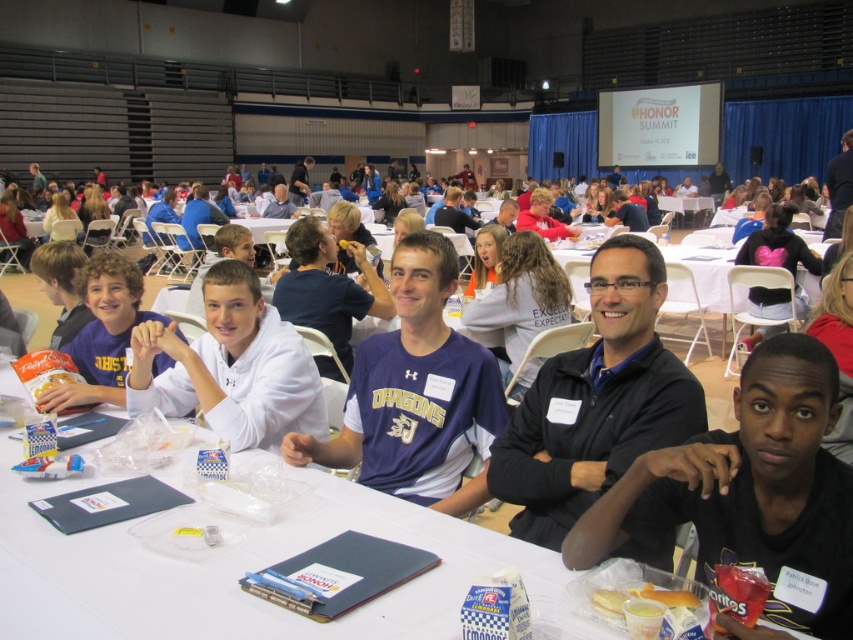
Which is behind, point (821, 433) or point (381, 387)?

The point (381, 387) is behind.

Does black matte shirt at lower right appear under purple jersey at center?

Correct, black matte shirt at lower right is located below purple jersey at center.

Identify the location of black matte shirt at lower right. (752, 492).

Who is taller, white paper plate at center or black matte shirt at lower right?

black matte shirt at lower right

Describe the element at coordinates (241, 568) in the screenshot. The height and width of the screenshot is (640, 853). I see `white paper plate at center` at that location.

Where is `white paper plate at center`? The image size is (853, 640). white paper plate at center is located at coordinates (241, 568).

Find the location of a particular element. This screenshot has width=853, height=640. white paper plate at center is located at coordinates (241, 568).

How distant is white matte shirt at center from matte white shirt at center?

white matte shirt at center and matte white shirt at center are 30.14 centimeters apart.

Who is positioned more to the left, white matte shirt at center or matte white shirt at center?

matte white shirt at center

Is point (260, 419) farther from viewer compared to point (57, 387)?

That is False.

Find the location of a particular element. white matte shirt at center is located at coordinates (231, 368).